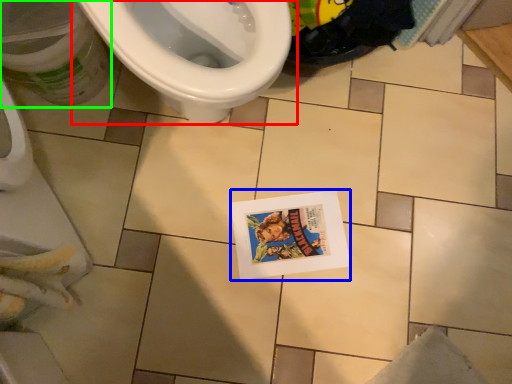
Question: Estimate the real-world distances between objects in this image. Which object is farther from toilet (highlighted by a red box), comic book (highlighted by a blue box) or potty (highlighted by a green box)?

Choices:
 (A) comic book
 (B) potty

Answer: (A)